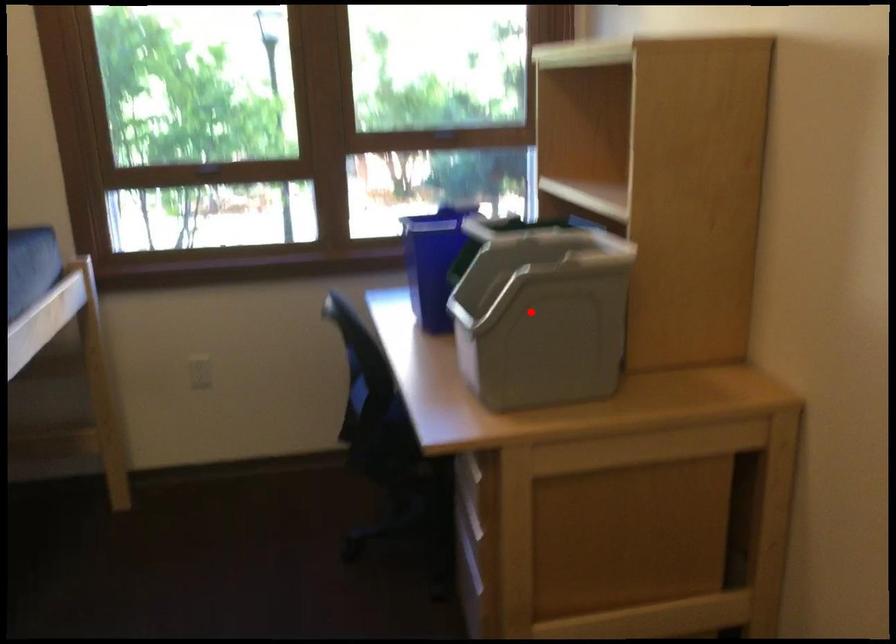
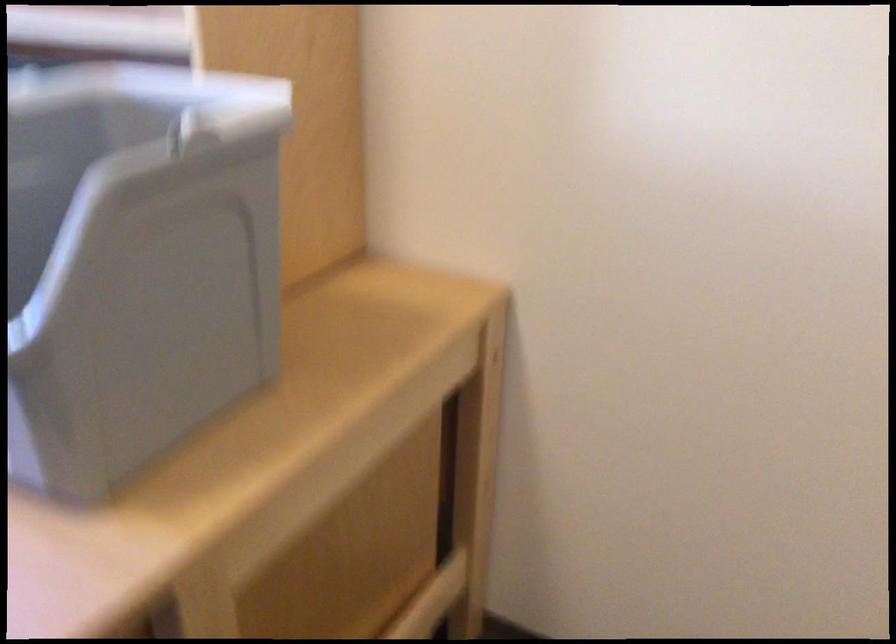
Question: I am providing you with two images of the same scene from different viewpoints. Image1 has a red point marked. In image2, the corresponding 3D location appears at what relative position? Reply with the corresponding letter.

Choices:
 (A) Closer
 (B) Farther

Answer: (A)